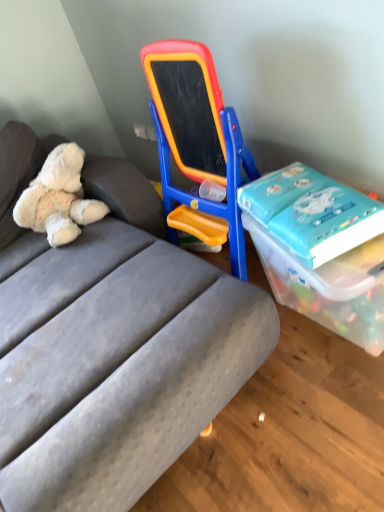
You are a GUI agent. You are given a task and a screenshot of the screen. Output one action in this format:
    pyautogui.click(x=<x>, y=<y>)
    Task: Click on the blank space situated above blue glossy book at right (from a real-world perspective)
    
    Given the screenshot: What is the action you would take?
    pyautogui.click(x=290, y=194)